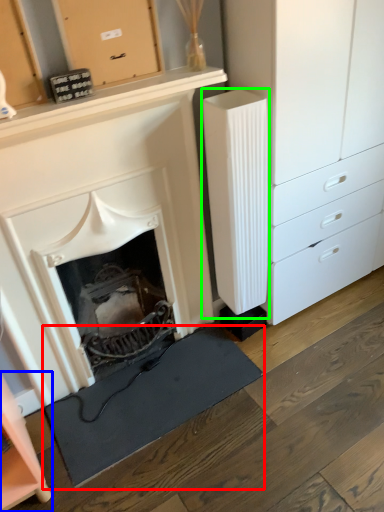
Question: Estimate the real-world distances between objects in this image. Which object is closer to doormat (highlighted by a red box), cabinetry (highlighted by a blue box) or appliance (highlighted by a green box)?

Choices:
 (A) cabinetry
 (B) appliance

Answer: (A)